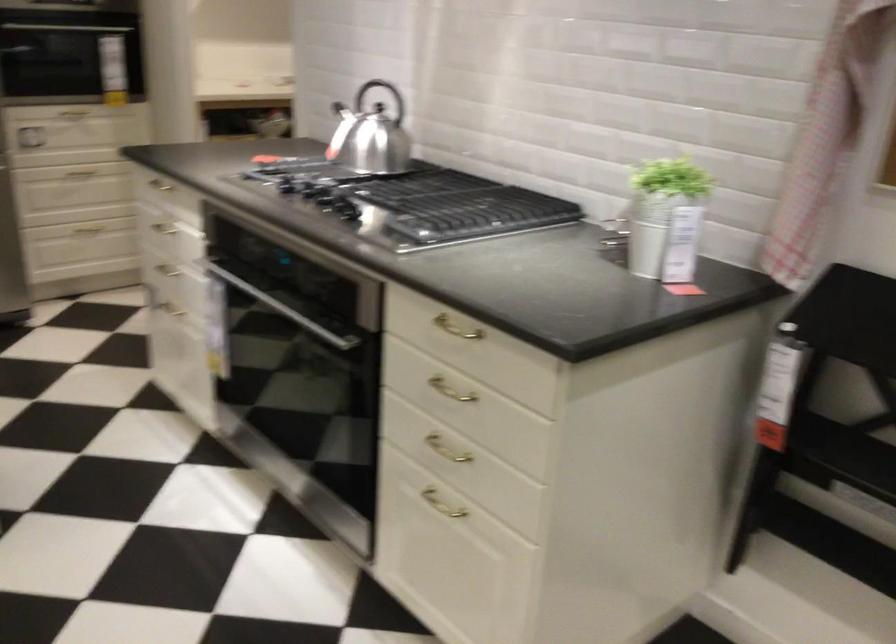
I want to click on kettle handle, so click(x=381, y=98).